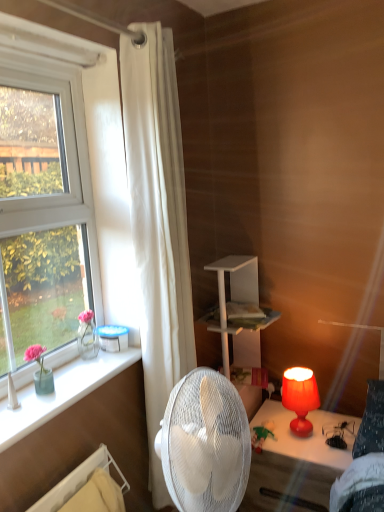
Question: Considering the positions of white fabric curtain at left and clear glass vase at left in the image, is white fabric curtain at left wider or thinner than clear glass vase at left?

Choices:
 (A) thin
 (B) wide

Answer: (A)

Question: From the image's perspective, is white fabric curtain at left positioned above or below clear glass vase at left?

Choices:
 (A) below
 (B) above

Answer: (B)

Question: Which is nearer to the matte red lamp at right?

Choices:
 (A) white fabric curtain at left
 (B) plush green bear at lower center
 (C) matte orange lampshade at lower right
 (D) clear glass vase at left

Answer: (C)

Question: Estimate the real-world distances between objects in this image. Which object is farther from the matte orange lampshade at lower right?

Choices:
 (A) clear glass vase at left
 (B) white fabric curtain at left
 (C) matte red lamp at right
 (D) plush green bear at lower center

Answer: (A)